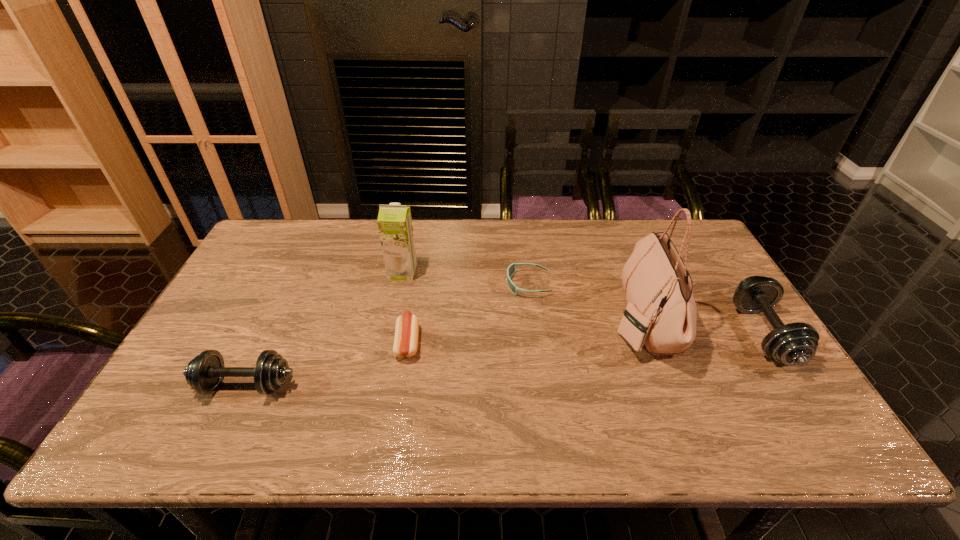
Where is `vacant space located on the back of the rightmost object`? Image resolution: width=960 pixels, height=540 pixels. vacant space located on the back of the rightmost object is located at coordinates [x=715, y=258].

In order to click on free space located 0.200m on the front-facing side of the fourth object from left to right in this screenshot , I will do `click(441, 284)`.

Find the location of a particular element. vacant position located 0.260m on the front-facing side of the fourth object from left to right is located at coordinates (420, 284).

What are the coordinates of `vacant space located 0.270m on the front-facing side of the fourth object from left to right` in the screenshot? It's located at (418, 284).

You are a GUI agent. You are given a task and a screenshot of the screen. Output one action in this format:
    pyautogui.click(x=<x>, y=<y>)
    Task: Click on the free space located on the back of the sausage
    
    Given the screenshot: What is the action you would take?
    pos(416,295)

Locate an element on the screen. This screenshot has height=540, width=960. vacant space situated 0.100m on the left of the second tallest object is located at coordinates (358, 272).

Find the location of a particular element. The image size is (960, 540). vacant position located 0.330m on the side of the handbag with the attached pouch is located at coordinates (495, 319).

This screenshot has height=540, width=960. In order to click on vacant space located on the side of the handbag with the attached pouch in this screenshot , I will do `click(588, 319)`.

Locate an element on the screen. vacant space positioned 0.220m on the side of the handbag with the attached pouch is located at coordinates (535, 319).

Image resolution: width=960 pixels, height=540 pixels. What are the coordinates of `object positioned at the left edge` in the screenshot? It's located at (204, 373).